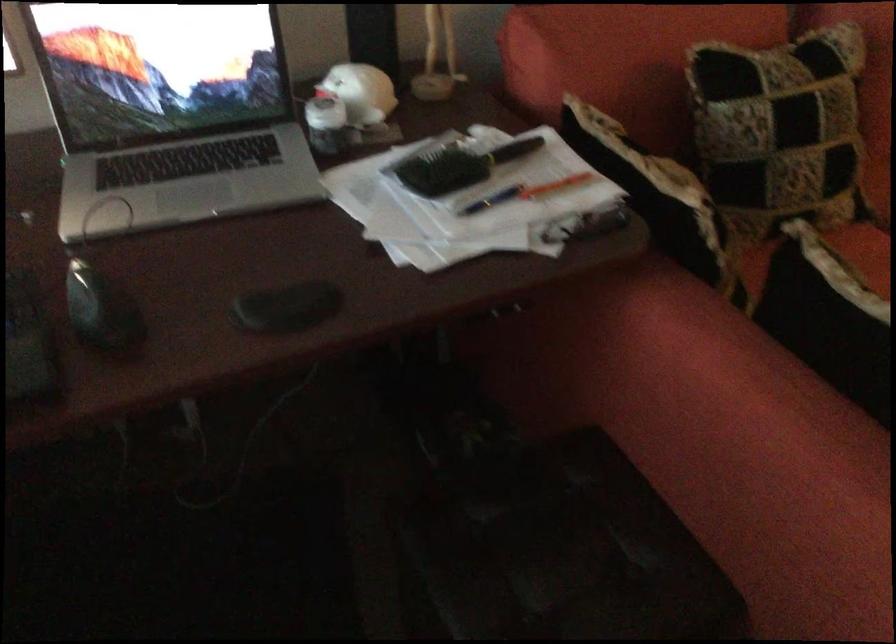
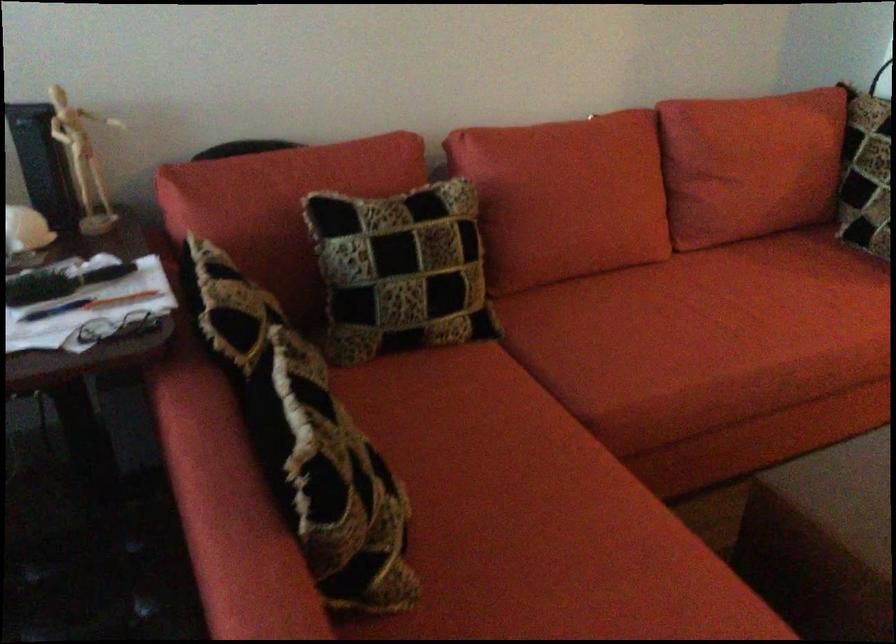
Find the pixel in the second image that matches pixel 784 131 in the first image.

(385, 263)